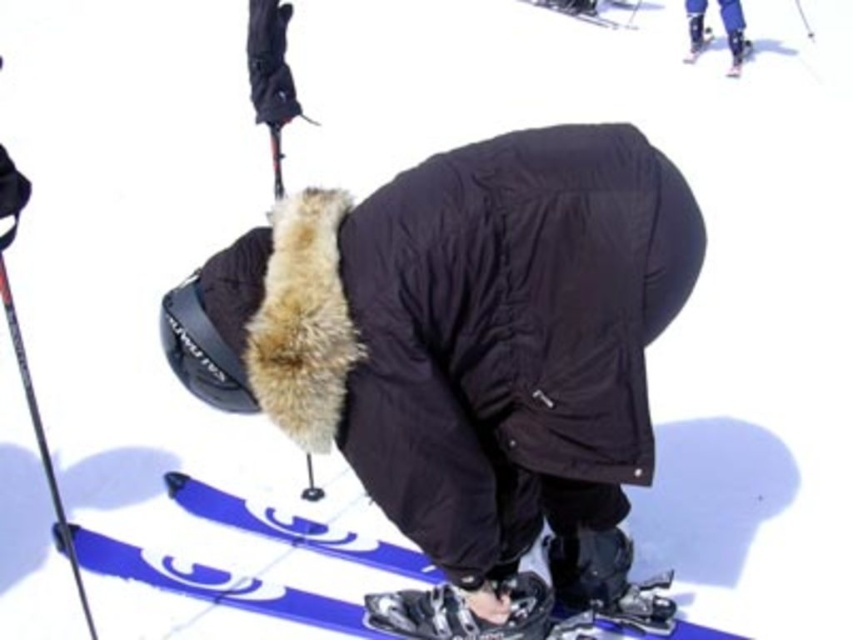
Question: Is black matte jacket at center wider than matte black ski boot at upper right?

Choices:
 (A) no
 (B) yes

Answer: (B)

Question: Which object appears closest to the camera in this image?

Choices:
 (A) black matte jacket at center
 (B) blue glossy ski at upper center
 (C) blue glossy ski at upper right
 (D) matte black ski boot at upper right

Answer: (A)

Question: Can you confirm if matte black ski boot at upper right is positioned to the left of blue glossy ski at upper center?

Choices:
 (A) yes
 (B) no

Answer: (B)

Question: Is matte black ski boot at upper right to the right of blue glossy ski at upper right from the viewer's perspective?

Choices:
 (A) no
 (B) yes

Answer: (A)

Question: Which object is the closest to the black matte jacket at center?

Choices:
 (A) blue glossy ski at upper right
 (B) matte black ski boot at upper right

Answer: (A)

Question: Which point is farther to the camera?

Choices:
 (A) (624, 26)
 (B) (747, 42)
 (C) (733, 64)

Answer: (A)